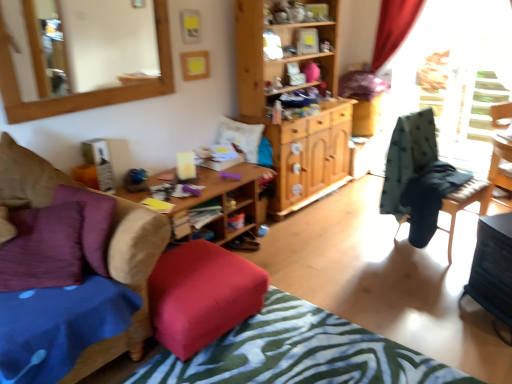
Identify the location of vacant area that is in front of wooden chair at right, acting as the 2th chair starting from the left. The image size is (512, 384). (433, 275).